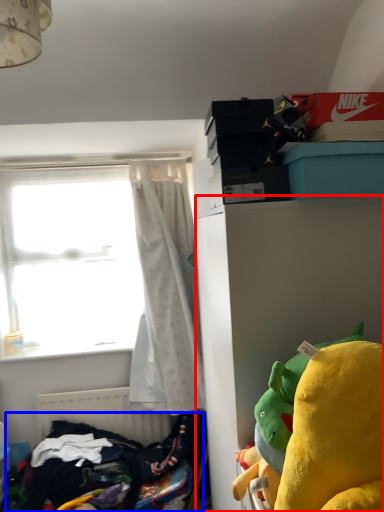
Question: Which object is further to the camera taking this photo, cabinetry (highlighted by a red box) or clothing (highlighted by a blue box)?

Choices:
 (A) cabinetry
 (B) clothing

Answer: (B)